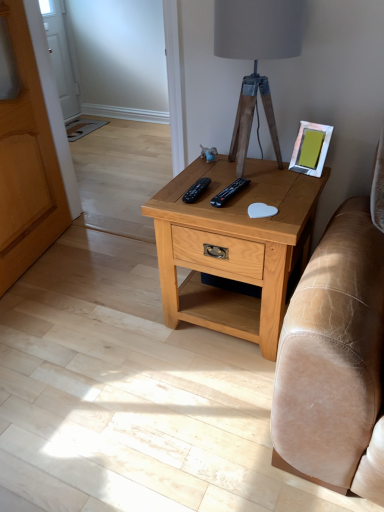
The image size is (384, 512). What are the coordinates of `free point below wooden armoire at left (from a real-world perspective)` in the screenshot? It's located at (46, 257).